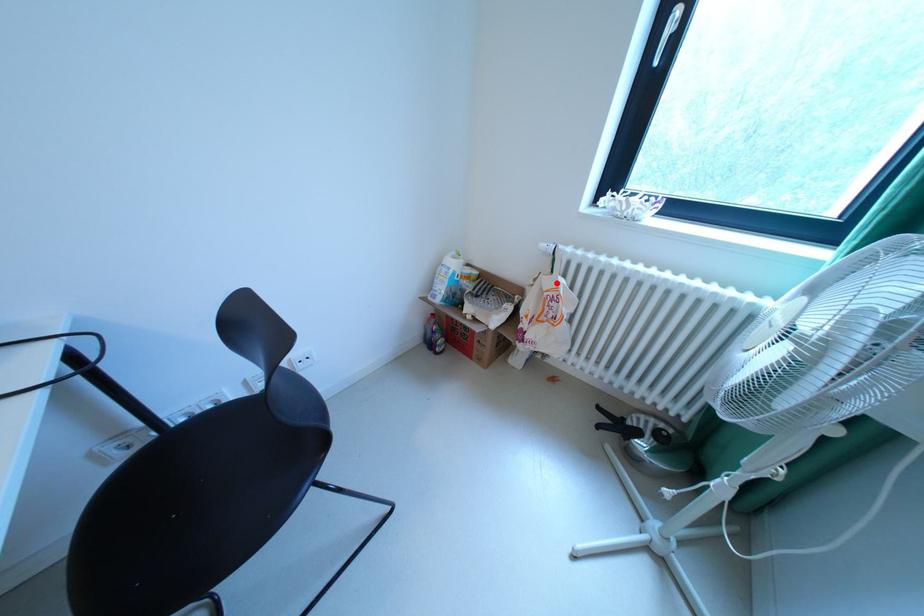
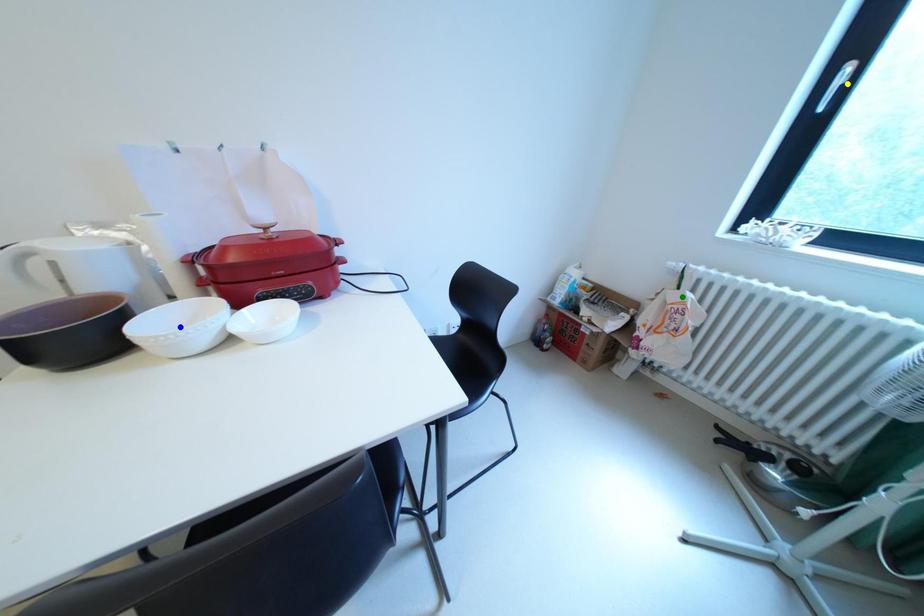
Question: I am providing you with two images of the same scene from different viewpoints. A red point is marked on the first image. You are given multiple points on the second image. Which mark in image 2 goes with the point in image 1?

Choices:
 (A) blue point
 (B) green point
 (C) yellow point

Answer: (B)